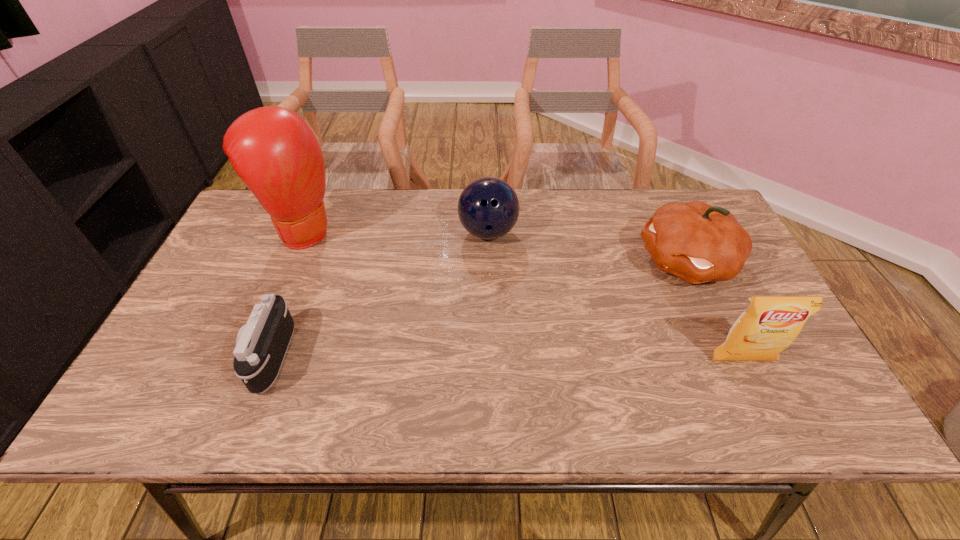
Locate an element on the screen. The height and width of the screenshot is (540, 960). the shortest object is located at coordinates (261, 345).

You are a GUI agent. You are given a task and a screenshot of the screen. Output one action in this format:
    pyautogui.click(x=<x>, y=<y>)
    Task: Click on the crisp (potato chip)
    
    Given the screenshot: What is the action you would take?
    pyautogui.click(x=769, y=325)

This screenshot has height=540, width=960. Identify the location of pumpkin. (698, 243).

This screenshot has height=540, width=960. I want to click on the tallest object, so click(272, 149).

This screenshot has width=960, height=540. What are the coordinates of `bowling ball` in the screenshot? It's located at (488, 208).

Where is `the fourth tallest object`? This screenshot has width=960, height=540. the fourth tallest object is located at coordinates (488, 208).

At what (x,y) coordinates should I click in order to perform the action: click on free space located 0.140m on the front lens of the camera. Please return your answer as a coordinate pair (x, y). Looking at the image, I should click on (190, 356).

At what (x,y) coordinates should I click in order to perform the action: click on vacant position located on the front lens of the camera. Please return your answer as a coordinate pair (x, y). The height and width of the screenshot is (540, 960). Looking at the image, I should click on (159, 356).

The width and height of the screenshot is (960, 540). In order to click on free space located on the front lens of the camera in this screenshot , I will do `click(190, 356)`.

At what (x,y) coordinates should I click in order to perform the action: click on vacant space located 0.190m on the front face of the pumpkin. Please return your answer as a coordinate pair (x, y). Looking at the image, I should click on (594, 305).